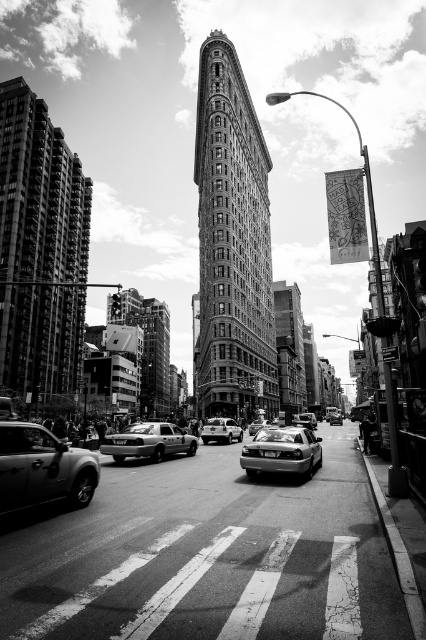
You are a pedestrian standing at the crosswalk in the foreground. You see a silver metallic taxi at center and a metallic silver sedan at center. How far apart are these two vehicles from each other?

The distance between the silver metallic taxi at center and the metallic silver sedan at center is 65.98 meters.

You are standing on the crosswalk in the foreground of the street scene. You notice two points marked on the image. The first point is at coordinates point [77,461], and the second is at point [342,419]. Which point is nearer to you?

Point [77,461] is closer to the viewer than point [342,419].

You are standing at the crosswalk in the foreground of the image. You want to reach the iconic Flatiron Building in the background. Which direction should you walk to avoid the matte silver truck at lower left?

Since the matte silver truck at lower left is located at point coordinates lower left, you should walk towards the right side of the crosswalk to avoid it and head toward the Flatiron Building in the center background.